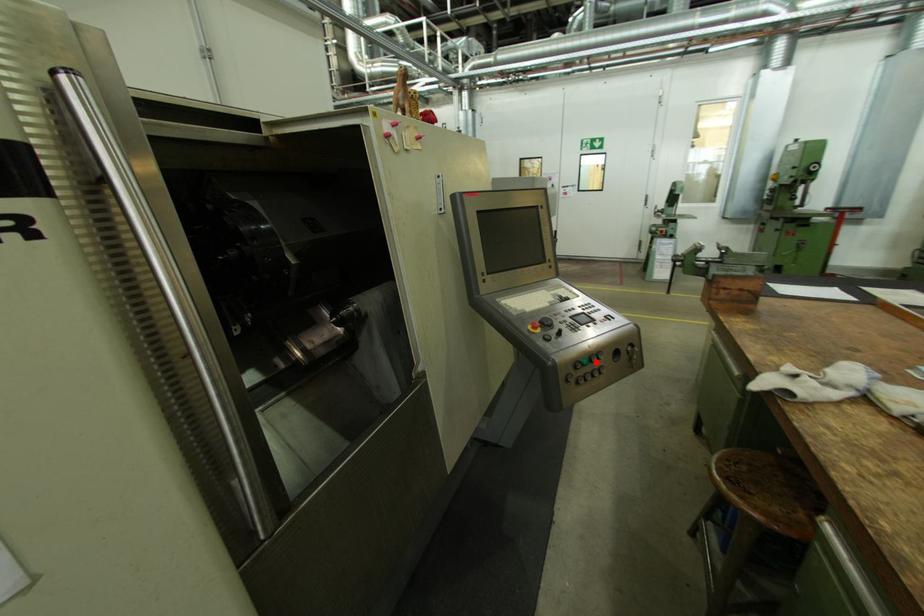
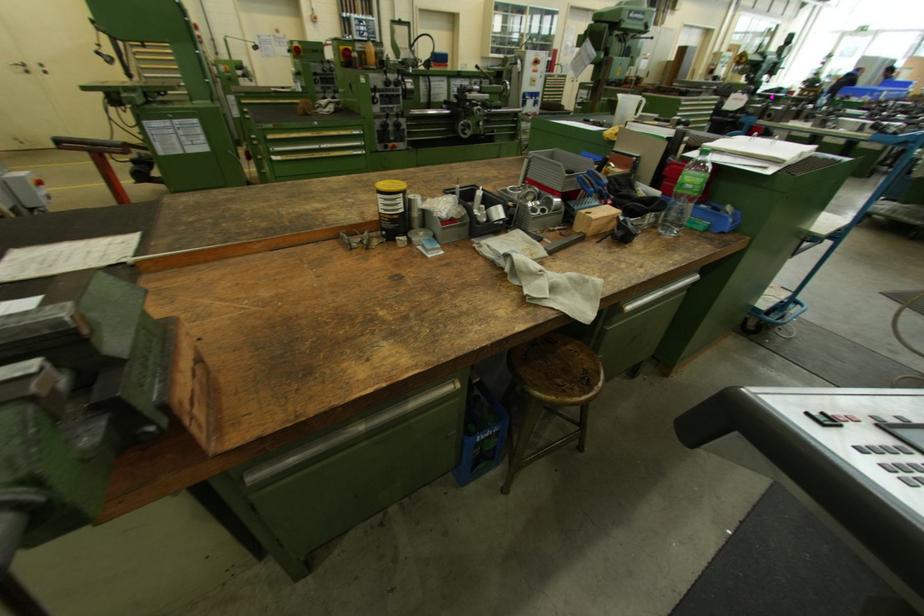
Question: I am providing you with two images of the same scene from different viewpoints. A red point is marked on the first image. At the location where the point appears in image 1, is it still visible in image 2?

Choices:
 (A) Yes
 (B) No

Answer: (B)